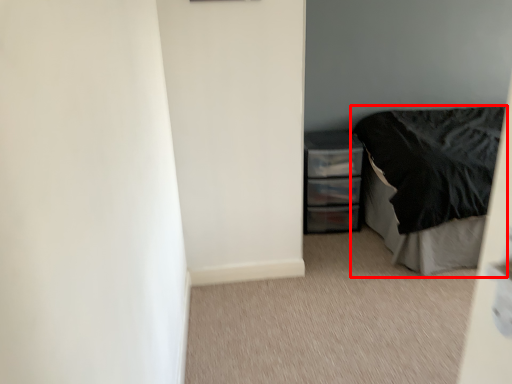
Question: From the image's perspective, where is bed (annotated by the red box) located in relation to chest of drawers in the image?

Choices:
 (A) below
 (B) above

Answer: (B)